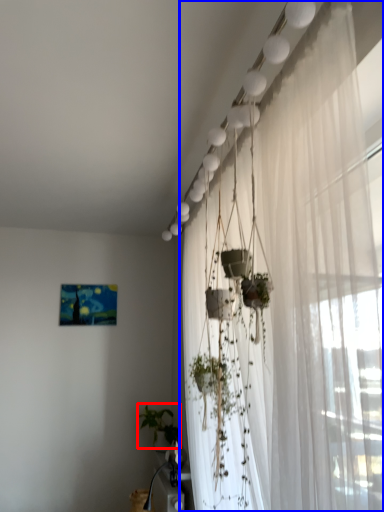
Question: Which point is further to the camera, plant (highlighted by a red box) or curtain (highlighted by a blue box)?

Choices:
 (A) plant
 (B) curtain

Answer: (A)